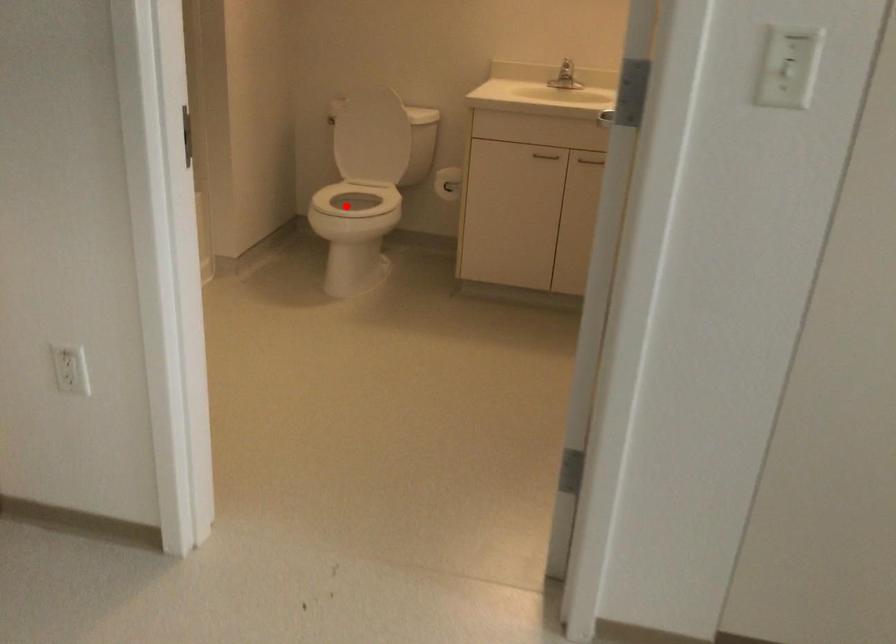
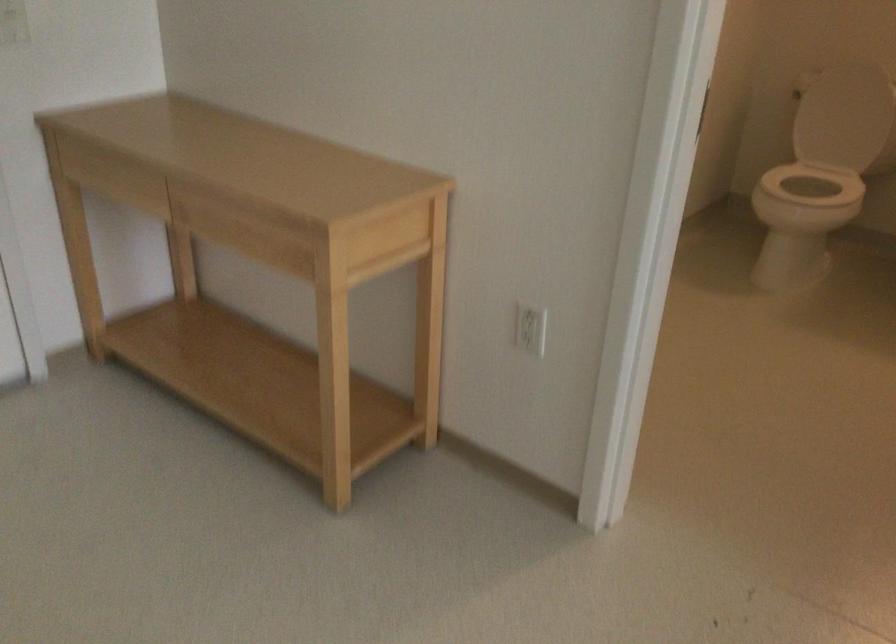
In the second image, find the point that corresponds to the highlighted location in the first image.

(814, 184)